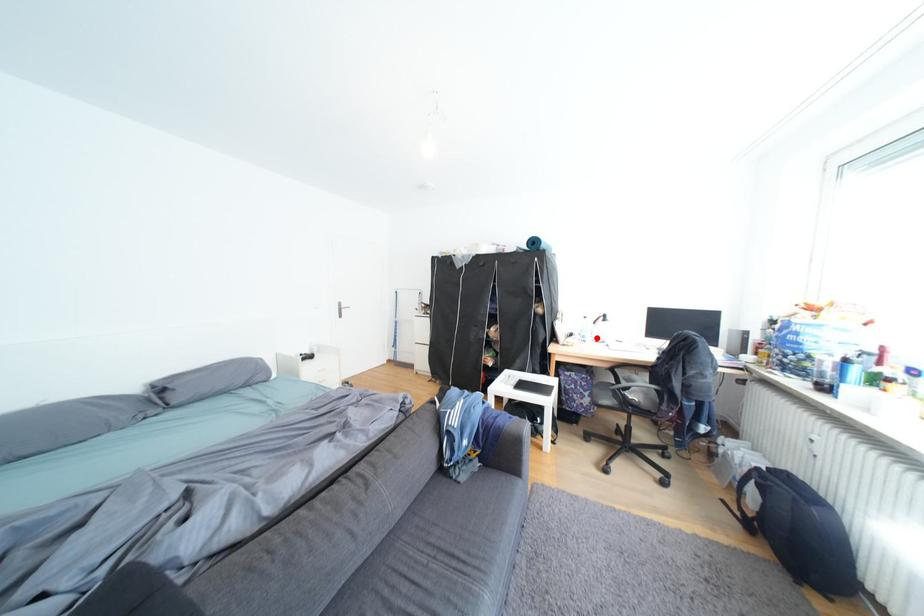
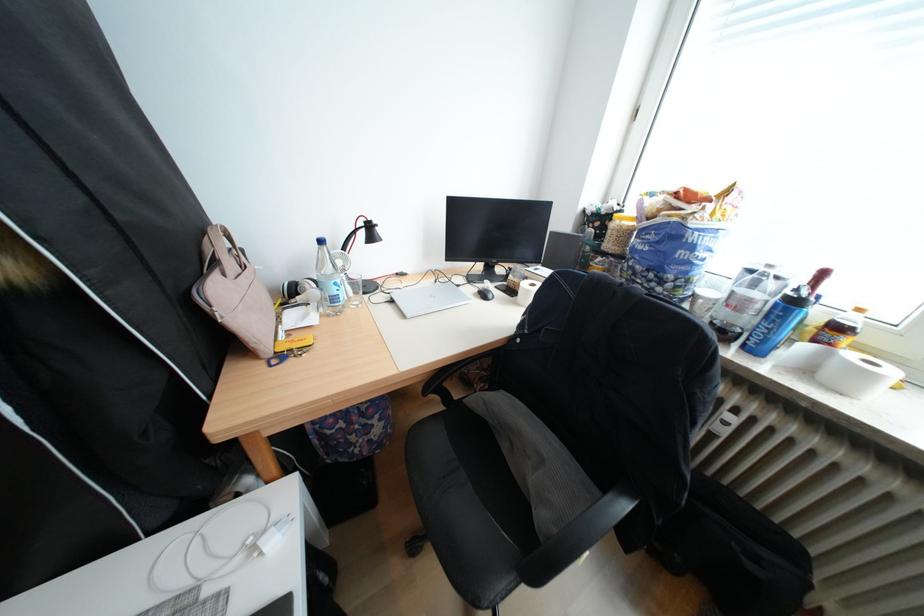
Question: I am providing you with two images of the same scene from different viewpoints. In image1, a red point is highlighted. Considering the same 3D point in image2, which of the following is correct?

Choices:
 (A) It is closer
 (B) It is farther

Answer: (A)